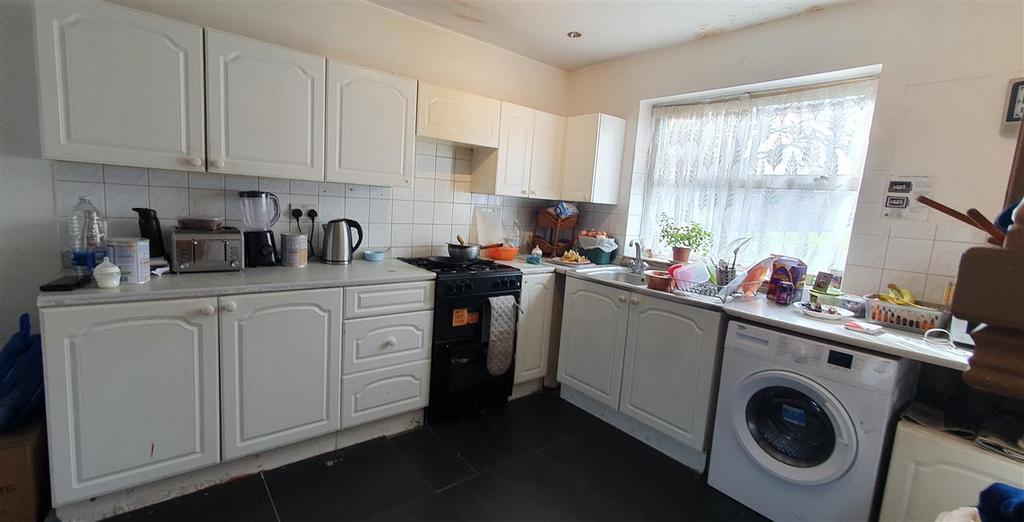
Find the location of a particular element. electric kettle is located at coordinates (333, 244).